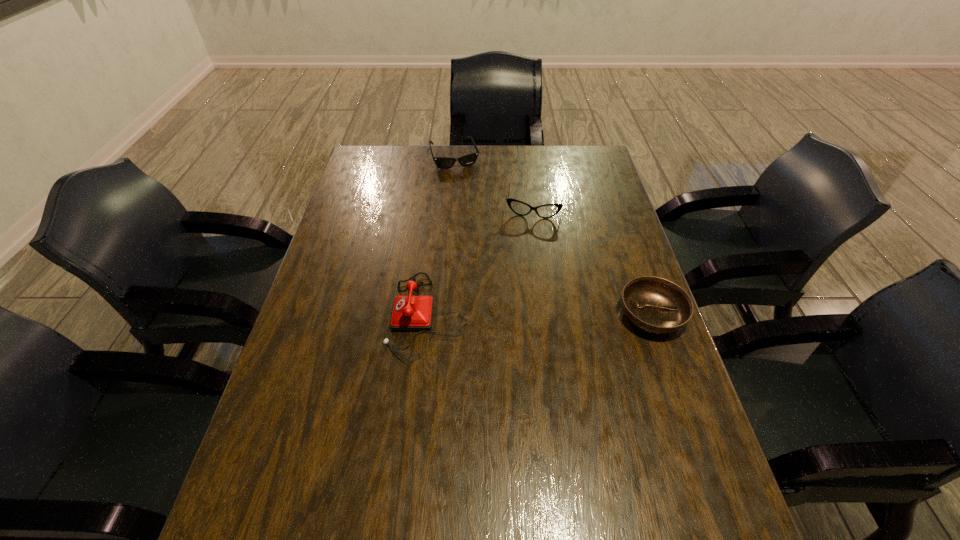
Where is `telephone`? This screenshot has width=960, height=540. telephone is located at coordinates (410, 313).

In order to click on soup bowl in this screenshot , I will do `click(653, 304)`.

Locate an element on the screen. Image resolution: width=960 pixels, height=540 pixels. spectacles is located at coordinates (546, 211).

What are the coordinates of `the second object from right to left` in the screenshot? It's located at (546, 211).

This screenshot has width=960, height=540. Identify the location of the farthest object. (467, 160).

Where is `free spot located on the dial of the tallest object`? free spot located on the dial of the tallest object is located at coordinates (315, 315).

Where is `vacant position located 0.140m on the dial of the tallest object`? vacant position located 0.140m on the dial of the tallest object is located at coordinates (334, 315).

Where is `vacant area located on the dial of the tallest object`? This screenshot has width=960, height=540. vacant area located on the dial of the tallest object is located at coordinates [x=342, y=315].

Find the location of a particular element. The width and height of the screenshot is (960, 540). vacant space located on the left of the rightmost object is located at coordinates (479, 315).

Find the location of a particular element. vacant space located 0.050m on the front-facing side of the third object from left to right is located at coordinates (529, 231).